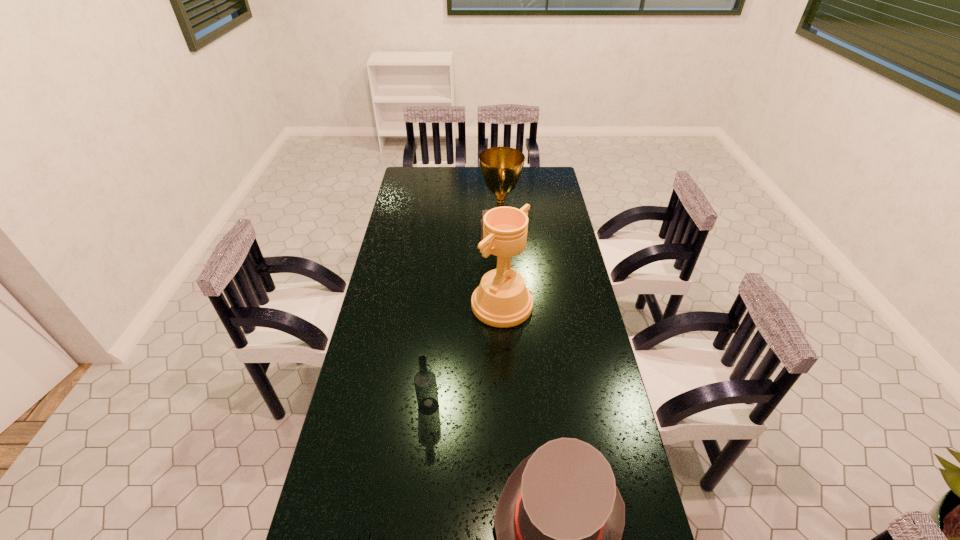
Where is `blank space at the left edge of the desktop`? The image size is (960, 540). blank space at the left edge of the desktop is located at coordinates (377, 390).

Locate an element on the screen. vacant space at the right edge is located at coordinates (539, 213).

Where is `vacant space at the far left corner of the desktop`? The image size is (960, 540). vacant space at the far left corner of the desktop is located at coordinates (431, 187).

Where is `vacant region at the far right corner of the desktop`? This screenshot has width=960, height=540. vacant region at the far right corner of the desktop is located at coordinates (558, 186).

You are a GUI agent. You are given a task and a screenshot of the screen. Output one action in this format:
    pyautogui.click(x=<x>, y=<y>)
    Task: Click on the free area in between the third nearest object and the leftmost object
    The width and height of the screenshot is (960, 540).
    Given the screenshot: What is the action you would take?
    [x=466, y=355]

The image size is (960, 540). What are the coordinates of `empty space between the third nearest object and the vodka` in the screenshot? It's located at (466, 355).

Where is `object that ranks as the third closest to the farther award`? object that ranks as the third closest to the farther award is located at coordinates (559, 521).

Identify which object is located as the third nearest to the farthest object. Please provide its 2D coordinates. Your answer should be formatted as a tuple, i.e. [(x, y)], where the tuple contains the x and y coordinates of a point satisfying the conditions above.

[(559, 521)]

The image size is (960, 540). I want to click on free space that satisfies the following two spatial constraints: 1. on the plaque of the farther award; 2. on the front side of the third nearest object, so click(x=503, y=305).